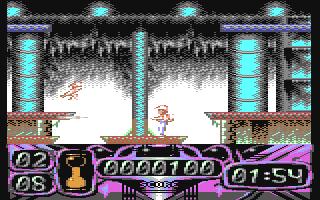
You are a GUI agent. You are given a task and a screenshot of the screen. Output one action in this format:
    pyautogui.click(x=<x>, y=<y>)
    Task: Click on the widest column
    This screenshot has width=320, height=200.
    Given the screenshot: What is the action you would take?
    pyautogui.click(x=250, y=86)